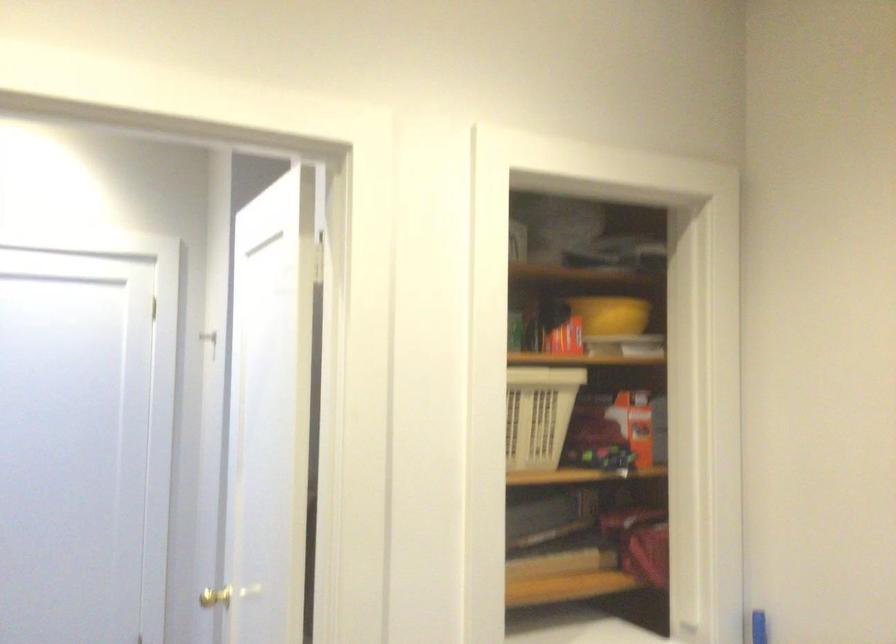
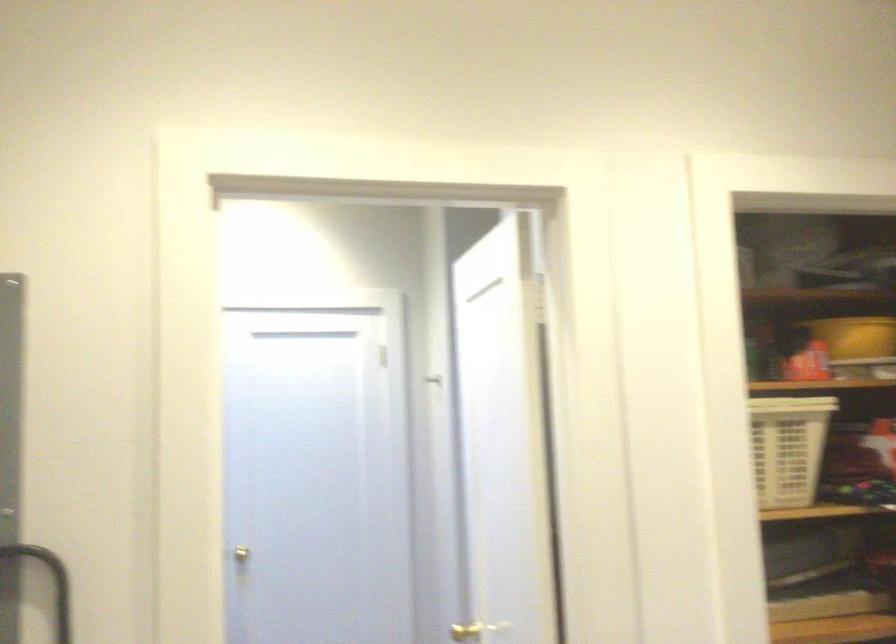
The point at (609, 317) is marked in the first image. Where is the corresponding point in the second image?

(855, 337)